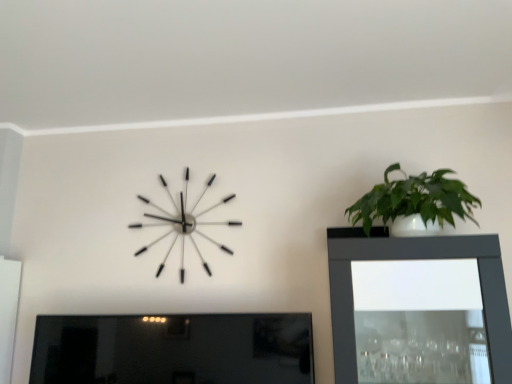
Question: Is matte black picture frame at lower left next to metallic silver clock at upper left?

Choices:
 (A) no
 (B) yes

Answer: (A)

Question: Is metallic silver clock at upper left at the back of matte black picture frame at lower left?

Choices:
 (A) yes
 (B) no

Answer: (B)

Question: Is matte black picture frame at lower left wider than metallic silver clock at upper left?

Choices:
 (A) no
 (B) yes

Answer: (B)

Question: Considering the relative sizes of matte black picture frame at lower left and metallic silver clock at upper left in the image provided, is matte black picture frame at lower left bigger than metallic silver clock at upper left?

Choices:
 (A) yes
 (B) no

Answer: (A)

Question: Would you say matte black picture frame at lower left is a long distance from metallic silver clock at upper left?

Choices:
 (A) yes
 (B) no

Answer: (B)

Question: Would you say metallic silver clock at upper left is inside or outside matte black picture frame at lower left?

Choices:
 (A) outside
 (B) inside

Answer: (A)

Question: From the image's perspective, is metallic silver clock at upper left above or below matte black picture frame at lower left?

Choices:
 (A) below
 (B) above

Answer: (B)

Question: From a real-world perspective, is metallic silver clock at upper left positioned above or below matte black picture frame at lower left?

Choices:
 (A) below
 (B) above

Answer: (B)

Question: Is metallic silver clock at upper left wider or thinner than matte black picture frame at lower left?

Choices:
 (A) thin
 (B) wide

Answer: (A)

Question: Looking at their shapes, would you say green glossy plant at upper right is wider or thinner than metallic silver clock at upper left?

Choices:
 (A) wide
 (B) thin

Answer: (A)

Question: In the image, is green glossy plant at upper right positioned in front of or behind metallic silver clock at upper left?

Choices:
 (A) front
 (B) behind

Answer: (A)

Question: Is green glossy plant at upper right taller or shorter than metallic silver clock at upper left?

Choices:
 (A) short
 (B) tall

Answer: (A)

Question: Is green glossy plant at upper right to the left or to the right of metallic silver clock at upper left in the image?

Choices:
 (A) left
 (B) right

Answer: (B)

Question: Considering the positions of matte black picture frame at lower left and metallic silver clock at upper left in the image, is matte black picture frame at lower left wider or thinner than metallic silver clock at upper left?

Choices:
 (A) wide
 (B) thin

Answer: (A)

Question: Visually, is matte black picture frame at lower left positioned to the left or to the right of metallic silver clock at upper left?

Choices:
 (A) right
 (B) left

Answer: (B)